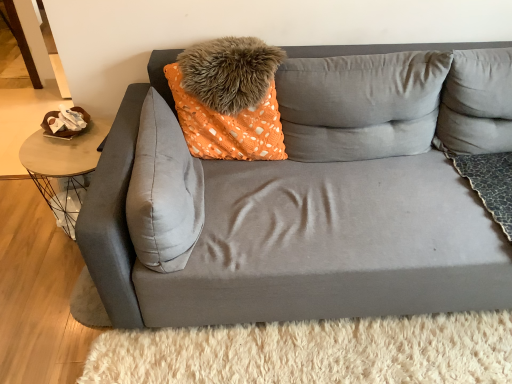
Where is `vacant space that is to the left of metallic wire table at left`? vacant space that is to the left of metallic wire table at left is located at coordinates (25, 221).